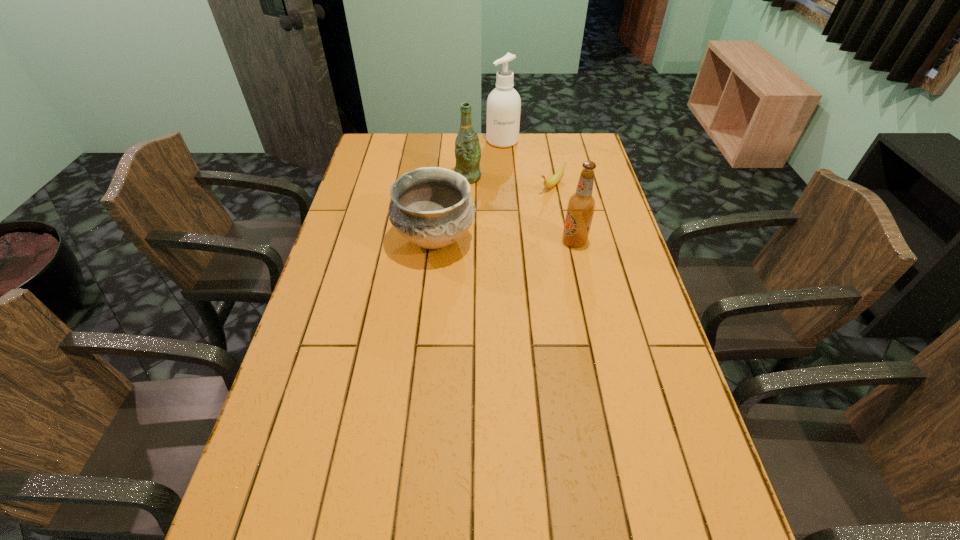
The height and width of the screenshot is (540, 960). I want to click on beer bottle that is at the right edge, so click(x=581, y=205).

Find the location of a particular element. banana that is at the right edge is located at coordinates (556, 177).

In the image, there is a desktop. In order to click on vacant space at the far edge in this screenshot , I will do `click(483, 147)`.

Find the location of `vacant area at the left edge`. vacant area at the left edge is located at coordinates (357, 291).

The image size is (960, 540). Identify the location of free spot at the right edge of the desktop. (639, 369).

Where is `vacant area that lies between the pottery and the nearer beer bottle`? The height and width of the screenshot is (540, 960). vacant area that lies between the pottery and the nearer beer bottle is located at coordinates (505, 240).

The width and height of the screenshot is (960, 540). Find the location of `free spot between the farther beer bottle and the tallest object`. free spot between the farther beer bottle and the tallest object is located at coordinates (485, 159).

In order to click on blank region between the left beer bottle and the farthest object in this screenshot , I will do `click(485, 159)`.

Locate an element on the screen. unoccupied area between the left beer bottle and the tallest object is located at coordinates (485, 159).

You are a GUI agent. You are given a task and a screenshot of the screen. Output one action in this format:
    pyautogui.click(x=<x>, y=<y>)
    Task: Click on the vacant space that's between the farther beer bottle and the right beer bottle
    The image size is (960, 540).
    Given the screenshot: What is the action you would take?
    pyautogui.click(x=521, y=210)